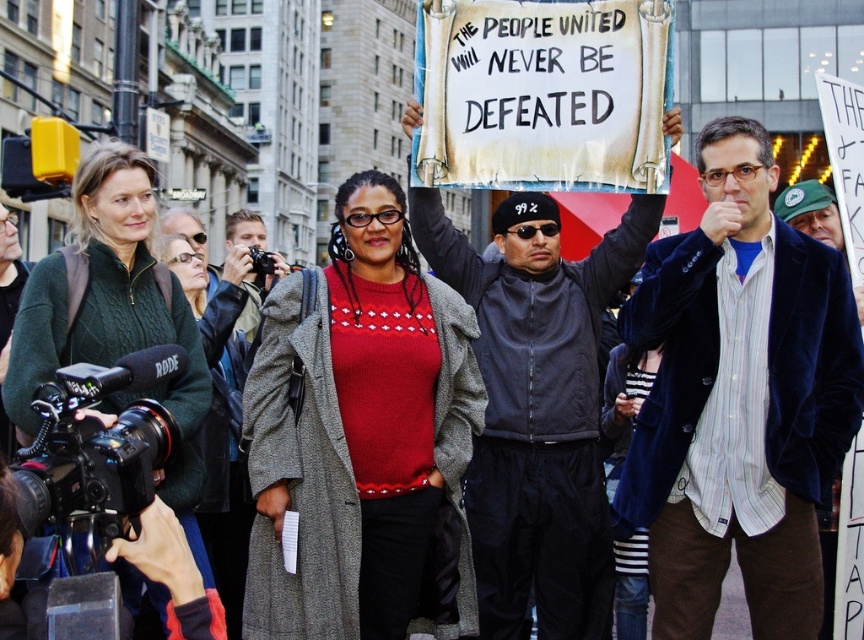
Which is behind, point (138, 289) or point (191, 257)?

The point (191, 257) is behind.

Does green knitted sweater at left appear over green wool coat at left?

Actually, green knitted sweater at left is below green wool coat at left.

Which is in front, point (124, 241) or point (246, 493)?

Point (124, 241) is more forward.

Identify the location of green knitted sweater at left. Image resolution: width=864 pixels, height=640 pixels. (113, 317).

Does point (448, 467) come farther from viewer compared to point (592, 323)?

That is False.

Which is above, knitted red sweater at center or dark gray leather jacket at center?

dark gray leather jacket at center

Does point (467, 356) come farther from viewer compared to point (642, 205)?

Yes.

Identify the location of knitted red sweater at center. (361, 438).

Does point (704, 508) lie in front of point (113, 317)?

Yes, it is in front of point (113, 317).

Does point (658, 408) come farther from viewer compared to point (126, 157)?

Yes, it is behind point (126, 157).

Does point (677, 490) come farther from viewer compared to point (18, 412)?

Yes.

At what (x,y) coordinates should I click in order to perform the action: click on velvet blue blazer at center. Please return your answer as a coordinate pair (x, y). The height and width of the screenshot is (640, 864). Looking at the image, I should click on (739, 400).